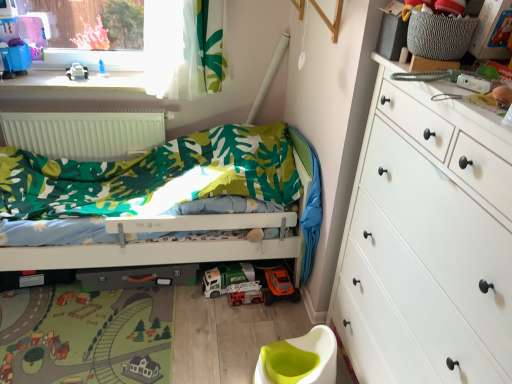
Question: Does white matte radiator at upper left have a lesser width compared to metallic silver fire truck at center, which is the 1th toy car in bottom-to-top order?

Choices:
 (A) no
 (B) yes

Answer: (B)

Question: Is white matte radiator at upper left directly adjacent to metallic silver fire truck at center, which is the 1th toy car in bottom-to-top order?

Choices:
 (A) no
 (B) yes

Answer: (A)

Question: Is metallic silver fire truck at center, which ranks as the 2th toy car in top-to-bottom order, at the back of white matte radiator at upper left?

Choices:
 (A) no
 (B) yes

Answer: (A)

Question: Is white matte radiator at upper left taller than metallic silver fire truck at center, which ranks as the 2th toy car in top-to-bottom order?

Choices:
 (A) no
 (B) yes

Answer: (B)

Question: From the image's perspective, is white matte radiator at upper left located above metallic silver fire truck at center, which ranks as the 2th toy car in top-to-bottom order?

Choices:
 (A) yes
 (B) no

Answer: (A)

Question: From a real-world perspective, is white matte chest of drawers at right physically located above or below white matte radiator at upper left?

Choices:
 (A) below
 (B) above

Answer: (B)

Question: Is white matte chest of drawers at right inside the boundaries of white matte radiator at upper left, or outside?

Choices:
 (A) outside
 (B) inside

Answer: (A)

Question: From the image's perspective, relative to white matte radiator at upper left, is white matte chest of drawers at right above or below?

Choices:
 (A) below
 (B) above

Answer: (A)

Question: Looking at their shapes, would you say white matte chest of drawers at right is wider or thinner than white matte radiator at upper left?

Choices:
 (A) thin
 (B) wide

Answer: (B)

Question: Is point (73, 66) positioned closer to the camera than point (247, 284)?

Choices:
 (A) closer
 (B) farther

Answer: (B)

Question: Relative to metallic silver fire truck at center, which ranks as the 2th toy car in top-to-bottom order, is white plastic toy car at upper left in front or behind?

Choices:
 (A) behind
 (B) front

Answer: (A)

Question: Choose the correct answer: Is white plastic toy car at upper left inside metallic silver fire truck at center, which is the 1th toy car in bottom-to-top order, or outside it?

Choices:
 (A) outside
 (B) inside

Answer: (A)

Question: Is white plastic toy car at upper left bigger or smaller than metallic silver fire truck at center, which ranks as the 2th toy car in top-to-bottom order?

Choices:
 (A) small
 (B) big

Answer: (B)

Question: From the image's perspective, is white matte radiator at upper left located above or below white matte chest of drawers at right?

Choices:
 (A) above
 (B) below

Answer: (A)

Question: Considering their positions, is white matte radiator at upper left located in front of or behind white matte chest of drawers at right?

Choices:
 (A) behind
 (B) front

Answer: (A)